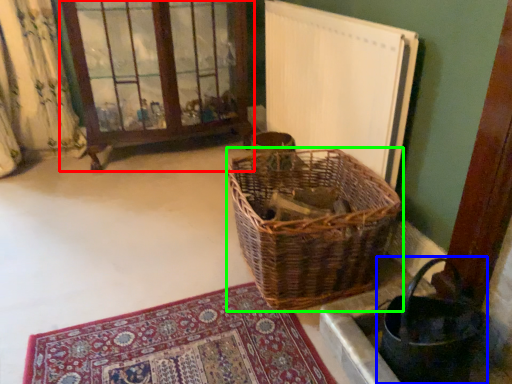
Question: Based on their relative distances, which object is nearer to window frame (highlighted by a red box)? Choose from basket (highlighted by a blue box) and picnic basket (highlighted by a green box).

Choices:
 (A) basket
 (B) picnic basket

Answer: (B)